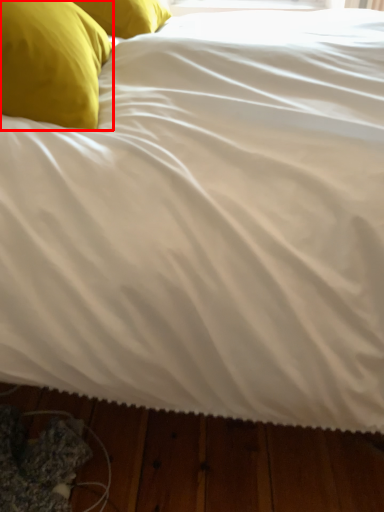
Question: From the image's perspective, where is pillow (annotated by the red box) located in relation to pillow in the image?

Choices:
 (A) below
 (B) above

Answer: (A)